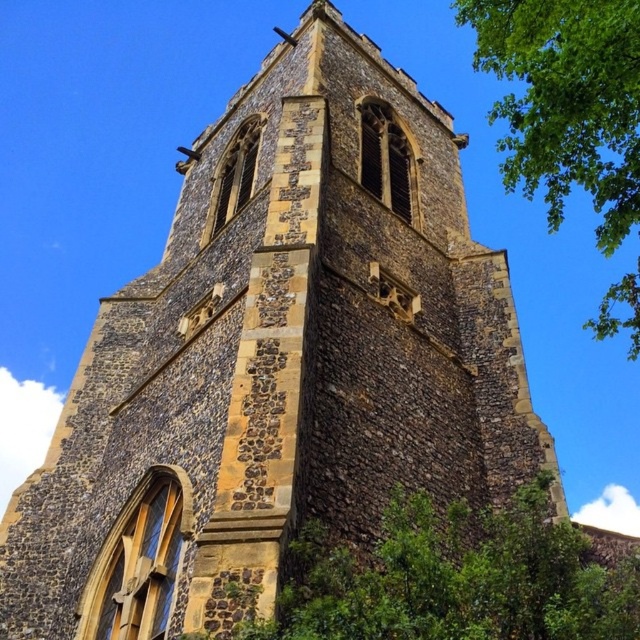
You are standing in front of the historic stone church tower. You notice a point marked at coordinates (452,577). What object is located at that point?

The point at (452,577) indicates a green leafy tree at center.